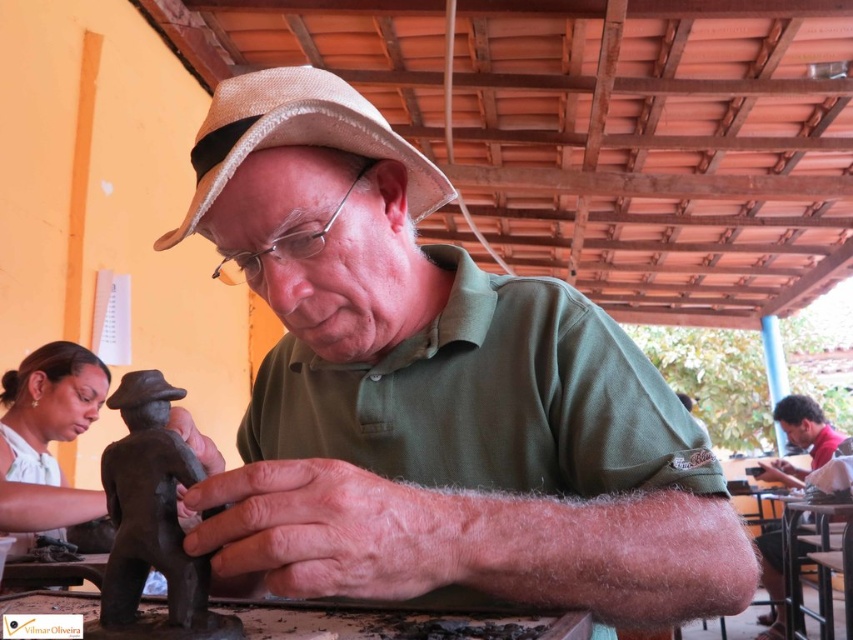
Question: Which of the following is the closest to the observer?

Choices:
 (A) [759, 536]
 (B) [363, 108]

Answer: (B)

Question: Which is nearer to the matte brown figurine at center?

Choices:
 (A) matte brown clay figure at center
 (B) matte brown statue at lower left
 (C) matte black figure at center

Answer: (B)

Question: Considering the real-world distances, which object is closest to the matte brown figurine at center?

Choices:
 (A) matte brown statue at lower left
 (B) matte brown clay figure at center

Answer: (A)

Question: Can you confirm if matte brown statue at lower left is wider than matte brown figurine at center?

Choices:
 (A) no
 (B) yes

Answer: (A)

Question: From the image, what is the correct spatial relationship of matte brown clay figure at center in relation to matte black figure at center?

Choices:
 (A) above
 (B) below

Answer: (B)

Question: Is matte brown clay figure at center closer to camera compared to straw hat at center?

Choices:
 (A) no
 (B) yes

Answer: (B)